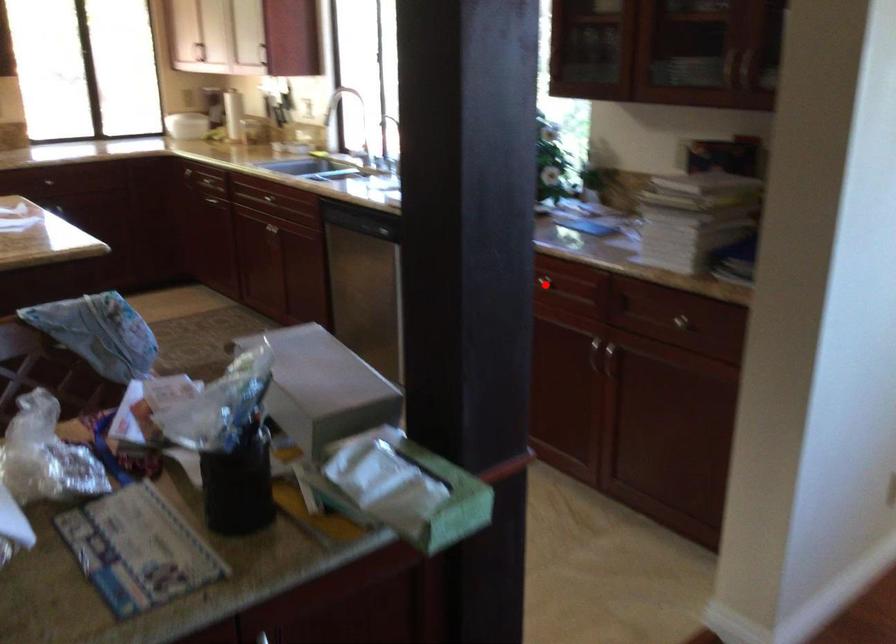
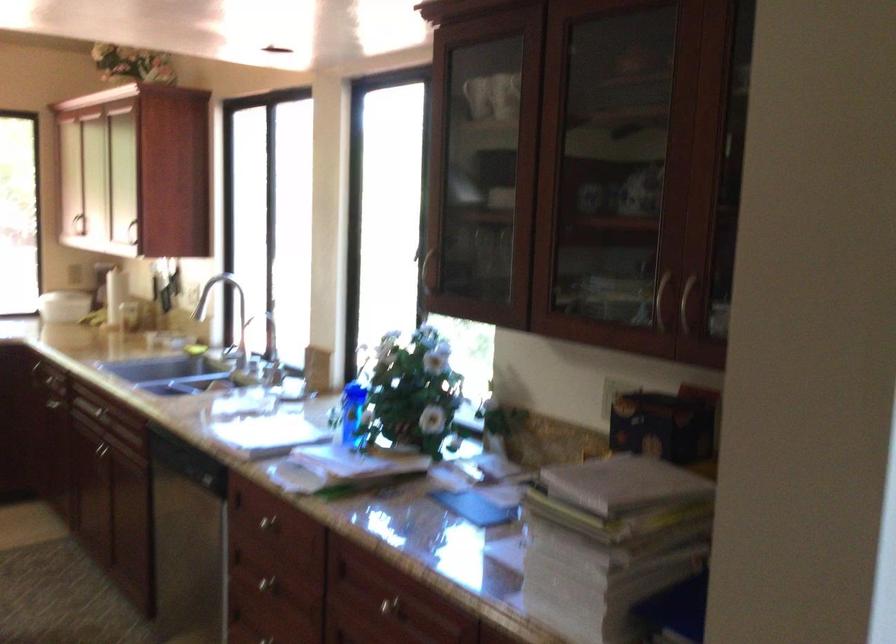
The point at the highlighted location is marked in the first image. Where is the corresponding point in the second image?

(386, 605)